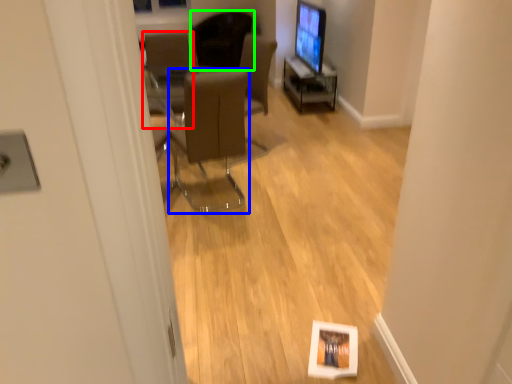
Question: Considering the real-world distances, which object is farthest from chair (highlighted by a red box)? chair (highlighted by a blue box) or chair (highlighted by a green box)?

Choices:
 (A) chair
 (B) chair

Answer: (A)